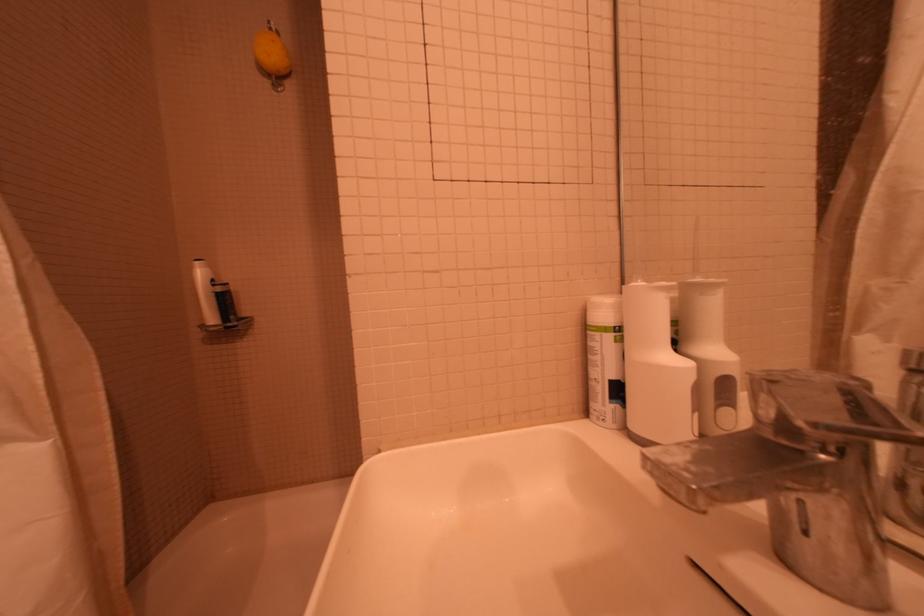
The height and width of the screenshot is (616, 924). What do you see at coordinates (272, 53) in the screenshot?
I see `the yellow sponge` at bounding box center [272, 53].